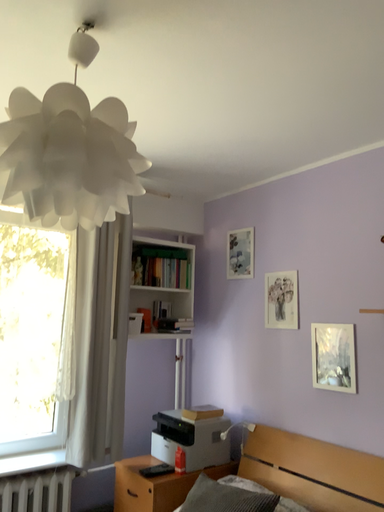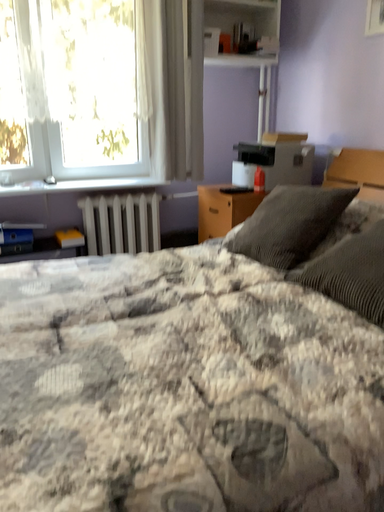
Question: Which way did the camera rotate in the video?

Choices:
 (A) rotated left
 (B) rotated right

Answer: (A)